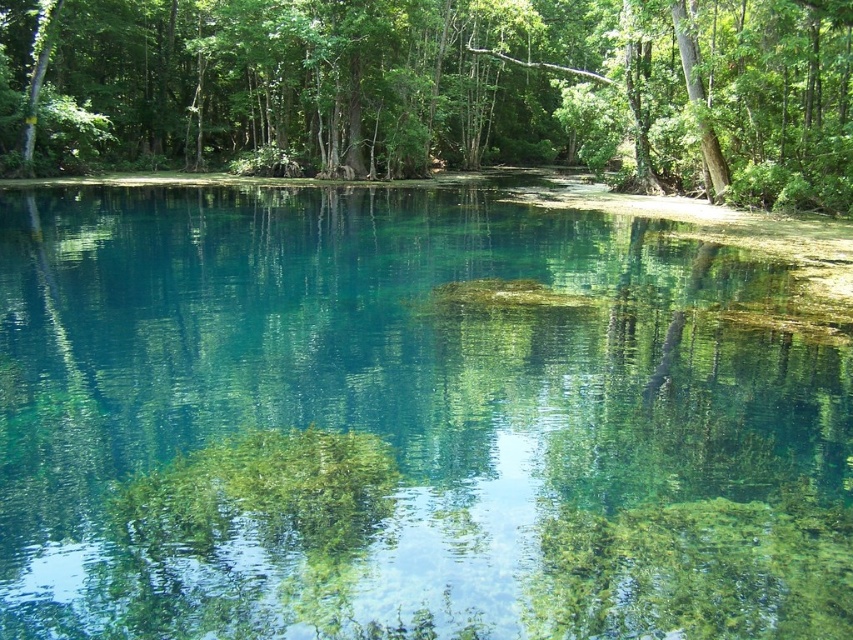
Is clear glassy water at center below green leafy tree at upper center?

Correct, clear glassy water at center is located below green leafy tree at upper center.

Which is below, clear glassy water at center or green leafy tree at upper center?

clear glassy water at center

The image size is (853, 640). Describe the element at coordinates (405, 422) in the screenshot. I see `clear glassy water at center` at that location.

At what (x,y) coordinates should I click in order to perform the action: click on clear glassy water at center. Please return your answer as a coordinate pair (x, y). Image resolution: width=853 pixels, height=640 pixels. Looking at the image, I should click on (405, 422).